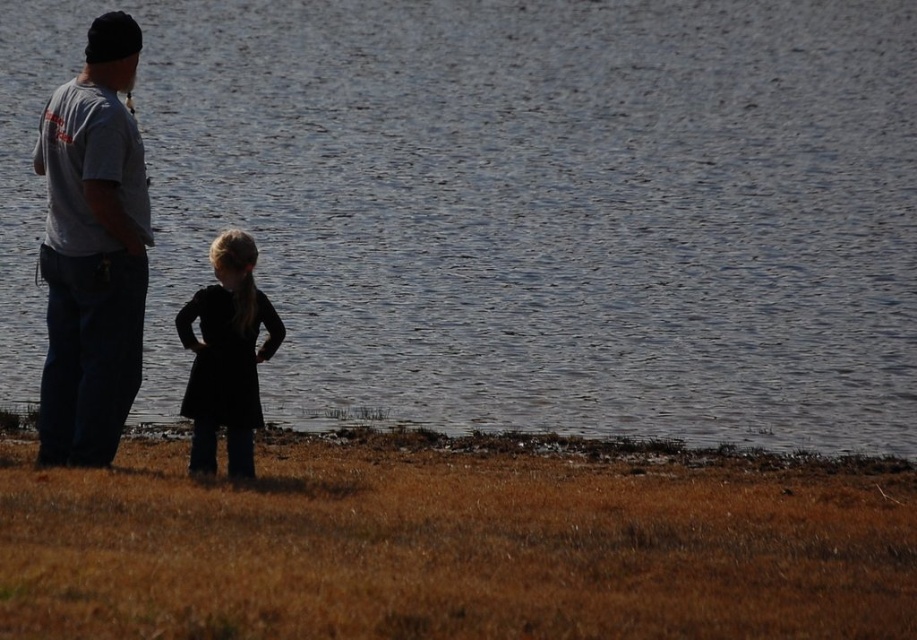
Between point (90, 225) and point (223, 362), which one is positioned behind?

Point (223, 362)

Where is `gray cotton shirt at left`? Image resolution: width=917 pixels, height=640 pixels. gray cotton shirt at left is located at coordinates (92, 250).

Who is shorter, glistening water at center or black matte dress at center?

black matte dress at center

This screenshot has height=640, width=917. What do you see at coordinates (518, 209) in the screenshot?
I see `glistening water at center` at bounding box center [518, 209].

Which is in front, point (809, 173) or point (244, 410)?

Point (244, 410)

Locate an element on the screen. glistening water at center is located at coordinates (518, 209).

Is glistening water at center to the right of gray cotton shirt at left from the viewer's perspective?

Yes, glistening water at center is to the right of gray cotton shirt at left.

Does glistening water at center appear under gray cotton shirt at left?

Incorrect, glistening water at center is not positioned below gray cotton shirt at left.

This screenshot has height=640, width=917. In order to click on glistening water at center in this screenshot , I will do `click(518, 209)`.